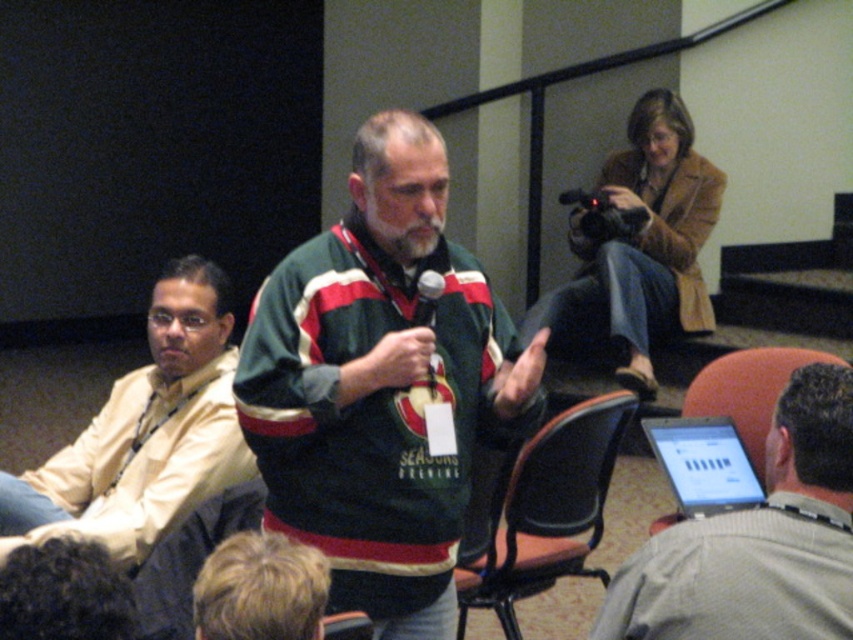
Based on the scene description, which object is taller between the green knit sweater at center and the orange fabric chair at lower right?

The green knit sweater at center is much taller than the orange fabric chair at lower right.